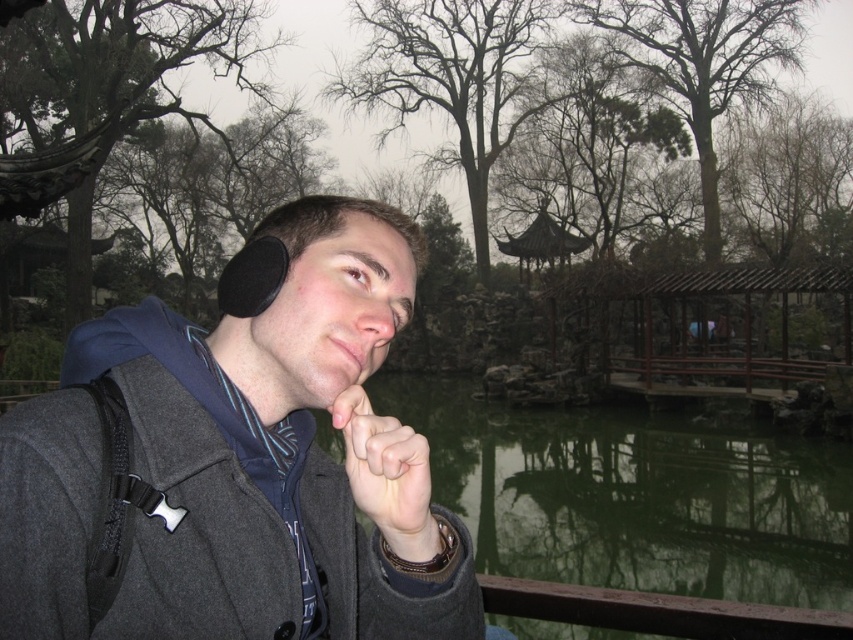
Question: Is dark gray wool jacket at center further to camera compared to wooden gazebo at center?

Choices:
 (A) yes
 (B) no

Answer: (B)

Question: Which of these objects is positioned closest to the green reflective water at center?

Choices:
 (A) skinny white hand at center
 (B) dark gray wool jacket at center

Answer: (B)

Question: Does green reflective water at center have a larger size compared to wooden gazebo at center?

Choices:
 (A) yes
 (B) no

Answer: (A)

Question: Which object appears closest to the camera in this image?

Choices:
 (A) green reflective water at center
 (B) skinny white hand at center
 (C) wooden gazebo at center
 (D) dark gray wool jacket at center

Answer: (D)

Question: Estimate the real-world distances between objects in this image. Which object is closer to the wooden gazebo at center?

Choices:
 (A) green reflective water at center
 (B) dark gray wool jacket at center
 (C) skinny white hand at center

Answer: (A)

Question: Observing the image, what is the correct spatial positioning of dark gray wool jacket at center in reference to green reflective water at center?

Choices:
 (A) right
 (B) left

Answer: (B)